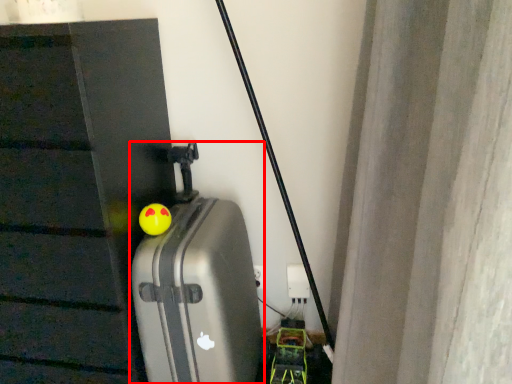
Question: Observing the image, what is the correct spatial positioning of suitcase (annotated by the red box) in reference to toy?

Choices:
 (A) left
 (B) right

Answer: (B)